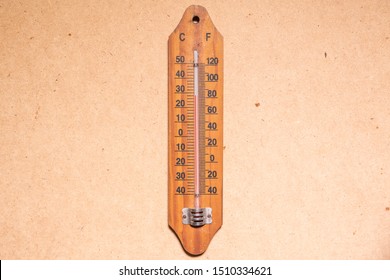
Find the location of `hole to put nail through to attach to wall`. hole to put nail through to attach to wall is located at coordinates (196, 19).